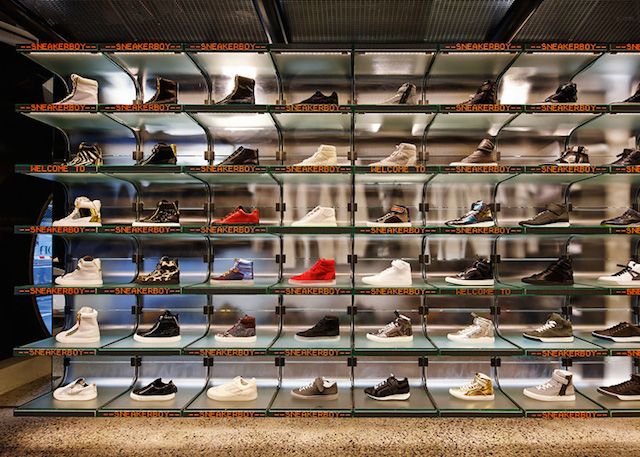
The height and width of the screenshot is (457, 640). Find the location of `sneakers on 3rd shelve`. sneakers on 3rd shelve is located at coordinates 86,278, 171,272, 239,274, 322,271, 397,276, 473,271, 550,273, 618,271.